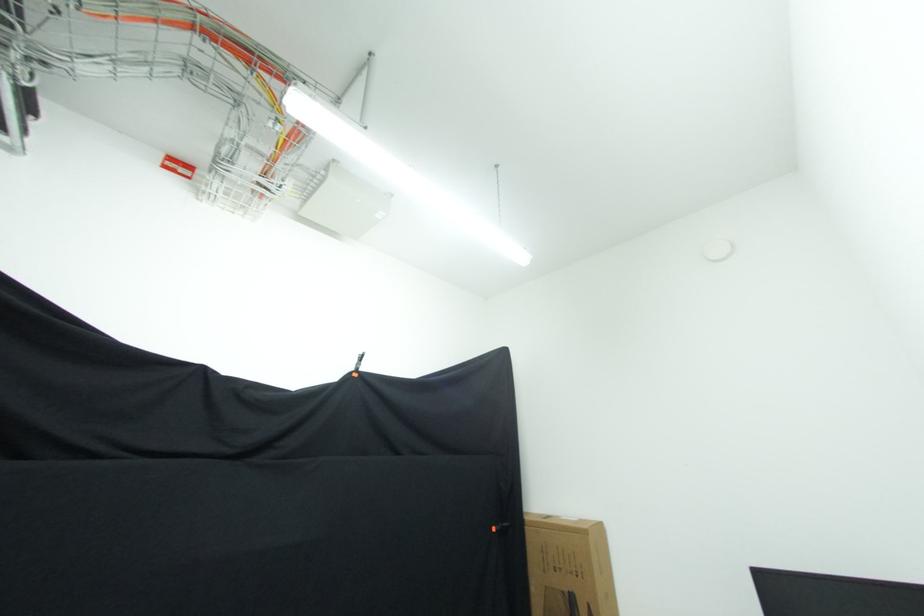
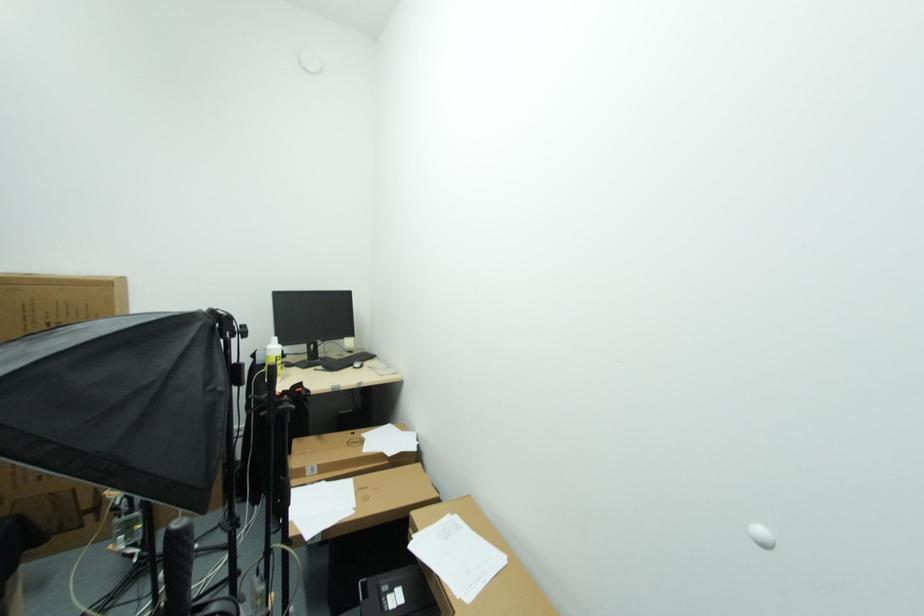
Question: The camera is either moving clockwise (left) or counter-clockwise (right) around the object. The first image is from the beginning of the video and the second image is from the end. Is the camera moving left or right when shooting the video?

Choices:
 (A) Left
 (B) Right

Answer: (A)